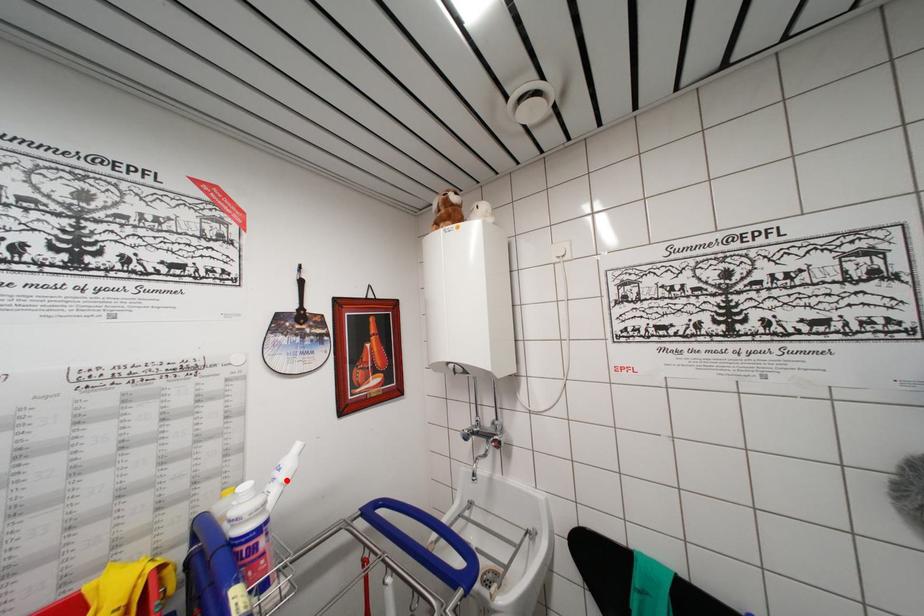
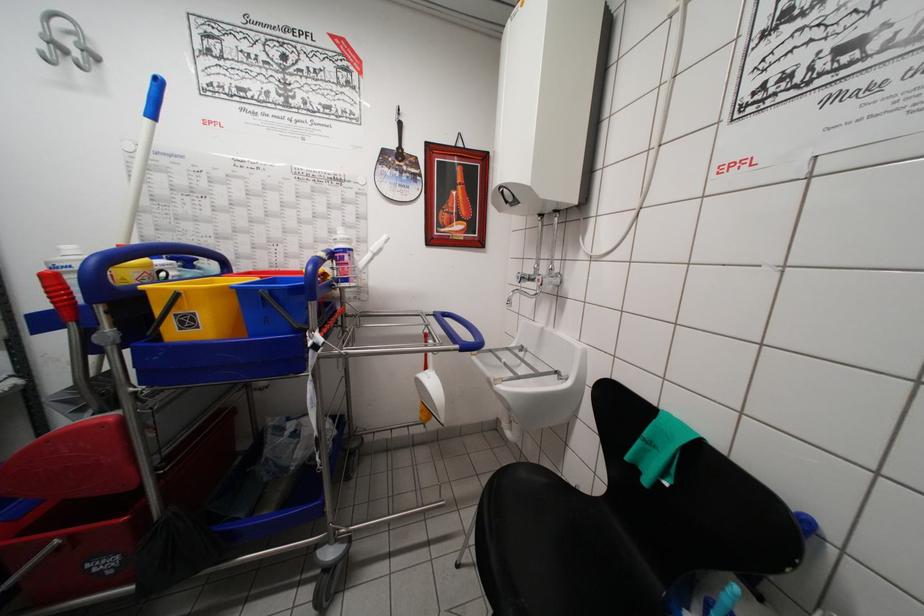
Question: I am providing you with two images of the same scene from different viewpoints. A red point is marked on the first image. At the location where the point appears in image 1, is it still visible in image 2?

Choices:
 (A) Yes
 (B) No

Answer: (A)